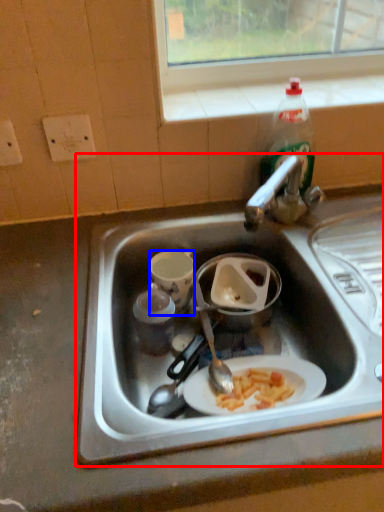
Question: Which object is further to the camera taking this photo, sink (highlighted by a red box) or coffee cup (highlighted by a blue box)?

Choices:
 (A) sink
 (B) coffee cup

Answer: (B)